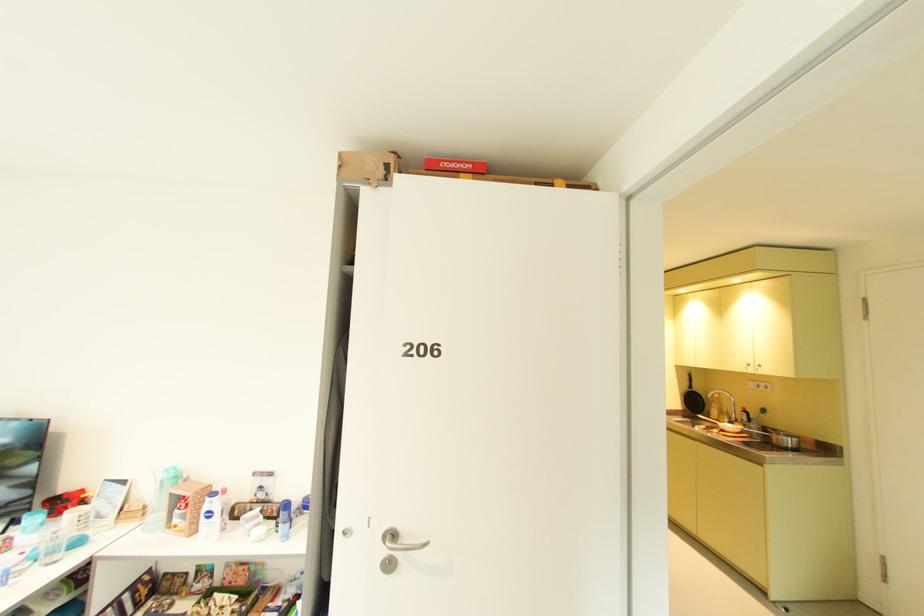
This screenshot has height=616, width=924. I want to click on blue spray can, so click(284, 520).